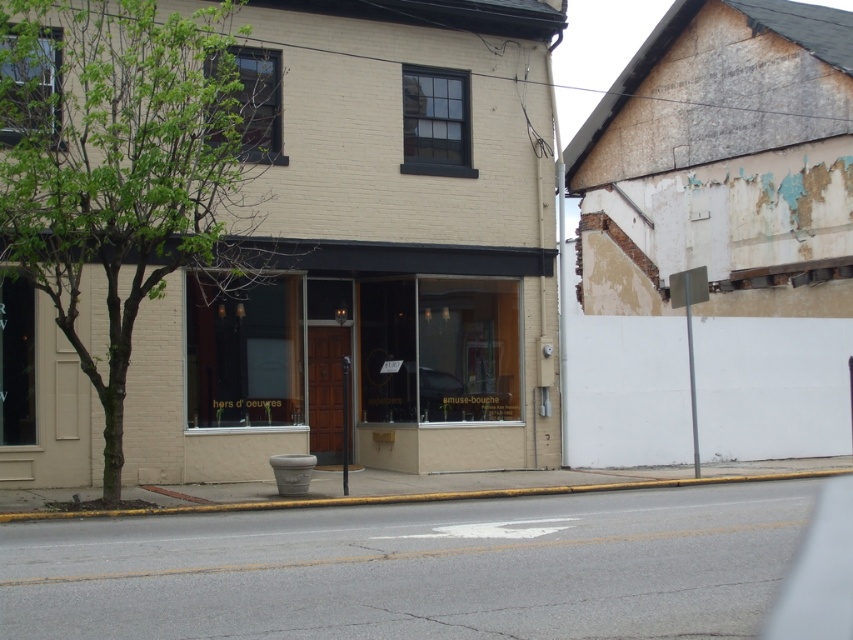
Question: Estimate the real-world distances between objects in this image. Which object is farther from the green leafy tree at left?

Choices:
 (A) matte glass storefront at center
 (B) yellow concrete curb at lower center

Answer: (A)

Question: Does matte glass storefront at center have a larger size compared to yellow concrete curb at lower center?

Choices:
 (A) yes
 (B) no

Answer: (B)

Question: Is green leafy tree at left above matte glass storefront at center?

Choices:
 (A) yes
 (B) no

Answer: (A)

Question: Based on their relative distances, which object is farther from the yellow concrete curb at lower center?

Choices:
 (A) green leafy tree at left
 (B) matte glass storefront at center

Answer: (B)

Question: Which object is farther from the camera taking this photo?

Choices:
 (A) green leafy tree at left
 (B) yellow concrete curb at lower center

Answer: (B)

Question: Does matte glass storefront at center come in front of yellow concrete curb at lower center?

Choices:
 (A) no
 (B) yes

Answer: (A)